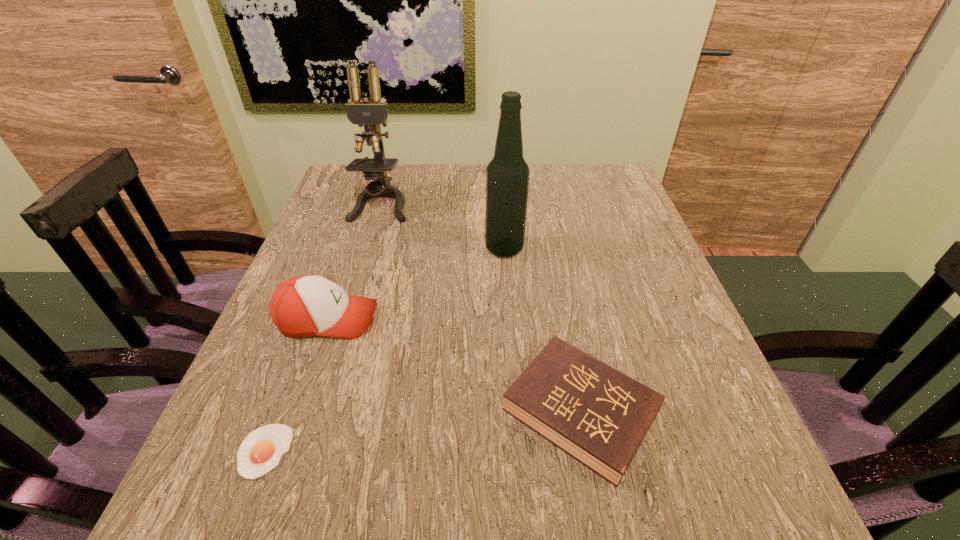
Where is `alcohol`? This screenshot has width=960, height=540. alcohol is located at coordinates click(507, 175).

The height and width of the screenshot is (540, 960). What are the coordinates of `the farthest object` in the screenshot? It's located at (371, 114).

I want to click on baseball cap, so click(303, 306).

In order to click on the third shortest object in this screenshot , I will do `click(303, 306)`.

The width and height of the screenshot is (960, 540). I want to click on hardback book, so click(596, 414).

The width and height of the screenshot is (960, 540). Find the location of `the shortest object`. the shortest object is located at coordinates (261, 450).

Identify the location of vacant space located on the right of the alcohol. (562, 248).

This screenshot has width=960, height=540. What are the coordinates of `blank space located 0.330m at the eyepieces of the farthest object` in the screenshot? It's located at click(347, 318).

You are a GUI agent. You are given a task and a screenshot of the screen. Output one action in this format:
    pyautogui.click(x=<x>, y=<y>)
    Task: Click on the free space located 0.300m on the front-facing side of the baseball cap
    
    Given the screenshot: What is the action you would take?
    pyautogui.click(x=528, y=319)

Where is `vacant area located 0.220m on the back of the hardback book`? The width and height of the screenshot is (960, 540). vacant area located 0.220m on the back of the hardback book is located at coordinates (554, 273).